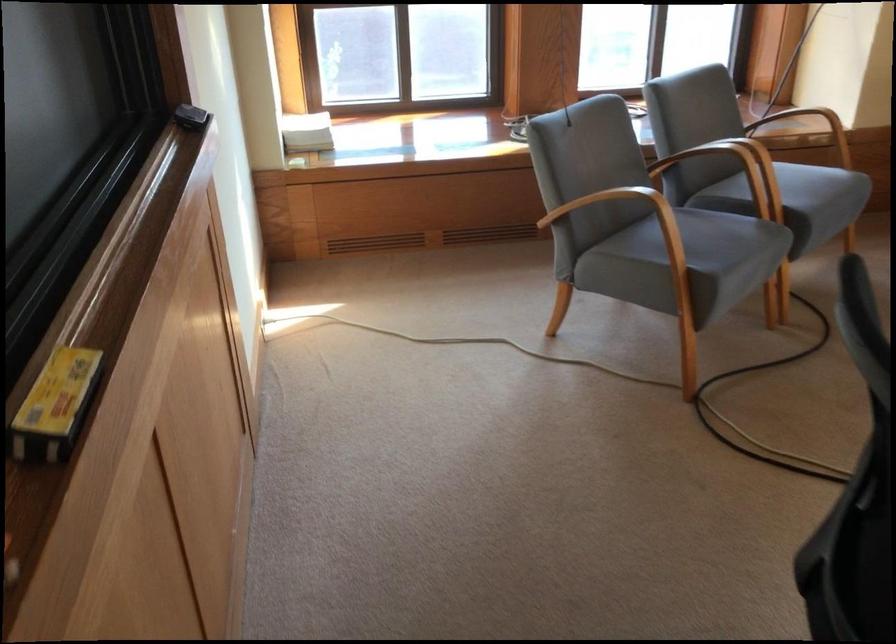
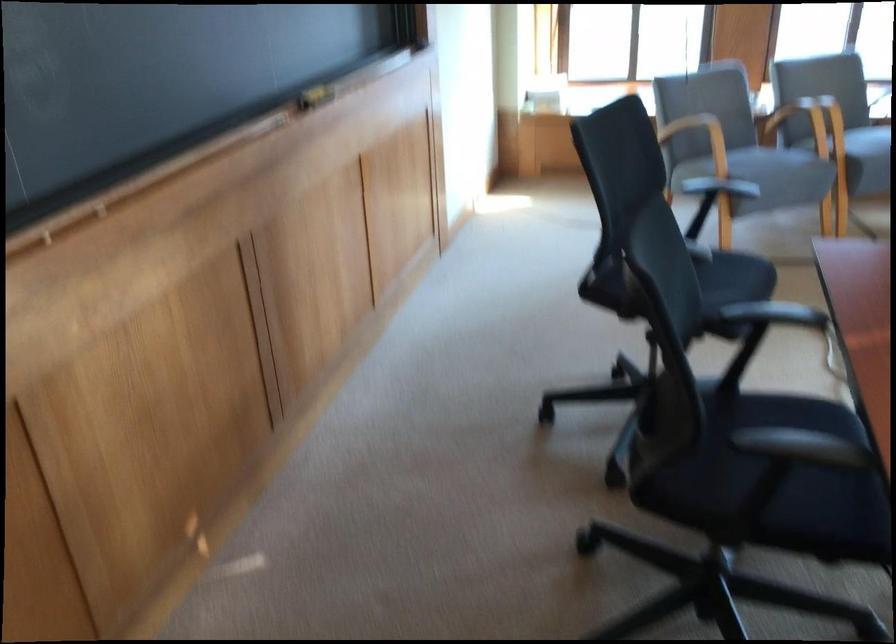
Find the pixel in the second image that matches (x=810, y=225) in the first image.

(859, 152)